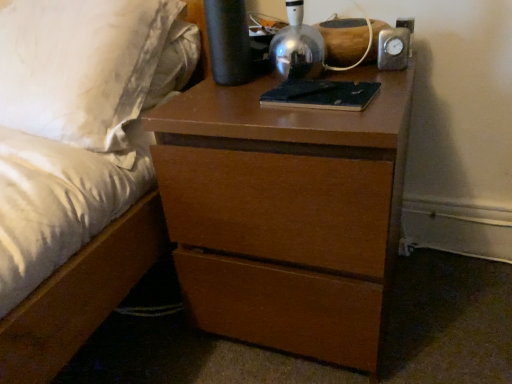
Question: From the image's perspective, is metallic dome at upper center positioned above or below dark blue leather book at center?

Choices:
 (A) below
 (B) above

Answer: (B)

Question: Relative to dark blue leather book at center, is metallic dome at upper center in front or behind?

Choices:
 (A) behind
 (B) front

Answer: (B)

Question: Which is nearer to the dark blue leather book at center?

Choices:
 (A) matte brown bed at center
 (B) metallic dome at upper center
 (C) brown wood chest of drawers at center

Answer: (B)

Question: Which is nearer to the matte brown bed at center?

Choices:
 (A) metallic dome at upper center
 (B) dark blue leather book at center
 (C) brown wood chest of drawers at center

Answer: (C)